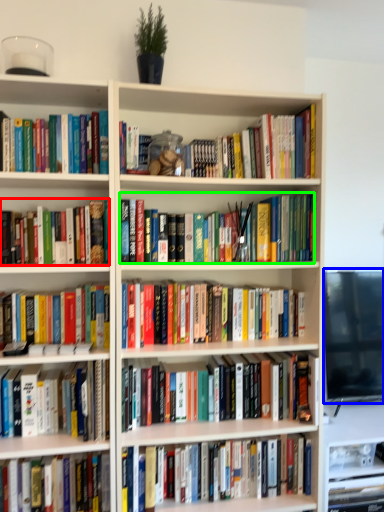
Question: Which object is positioned farthest from book (highlighted by a red box)? Select from computer monitor (highlighted by a blue box) and book (highlighted by a green box).

Choices:
 (A) computer monitor
 (B) book

Answer: (A)